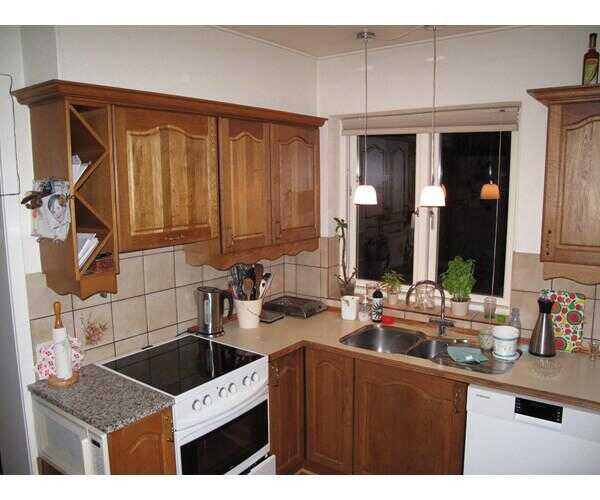
Locate an element on the screen. This screenshot has width=600, height=500. tile backsplash, off light brown is located at coordinates (556, 277).